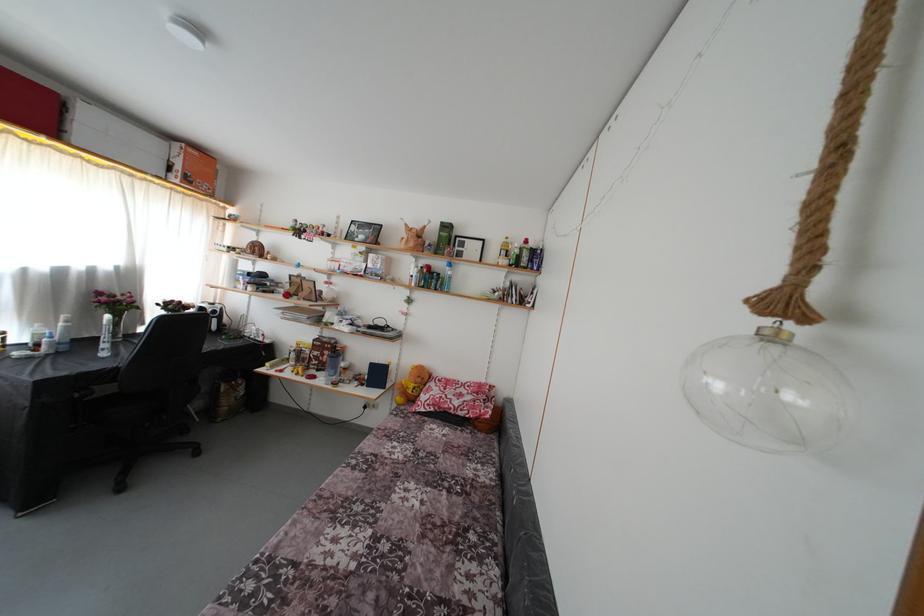
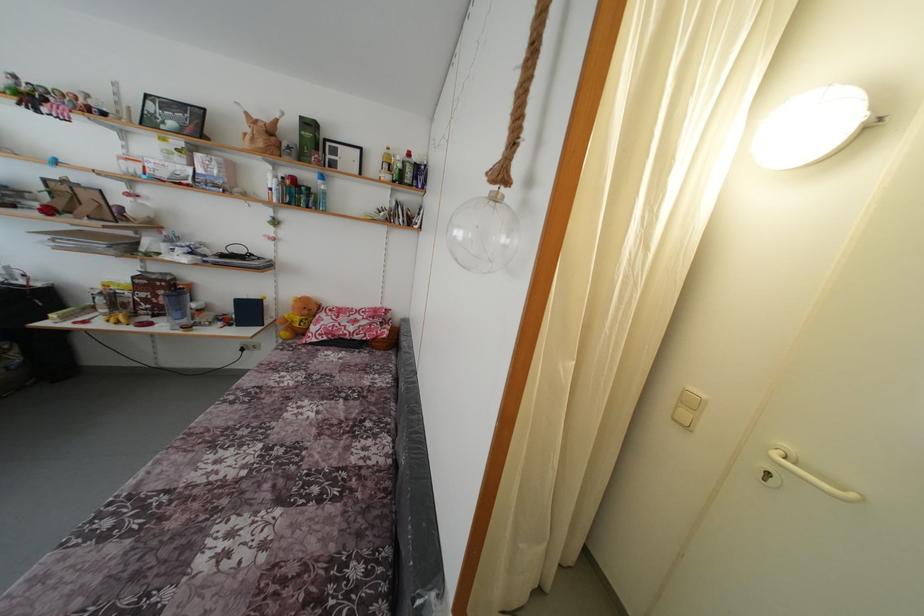
Find the pixel in the second image that matches the point at 322,359 in the first image.

(149, 301)